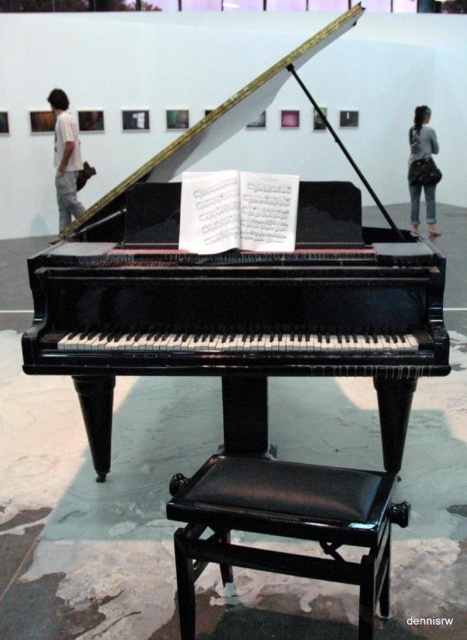
Does glossy black piano at center appear on the right side of white cotton pants at left?

Correct, you'll find glossy black piano at center to the right of white cotton pants at left.

What are the coordinates of `glossy black piano at center` in the screenshot? It's located at pos(236,292).

Does glossy black piano at center have a larger size compared to black leather stool at center?

Yes, glossy black piano at center is bigger than black leather stool at center.

Does glossy black piano at center have a smaller size compared to black leather stool at center?

No.

Where is `glossy black piano at center`? Image resolution: width=467 pixels, height=640 pixels. glossy black piano at center is located at coordinates (236, 292).

I want to click on glossy black piano at center, so click(236, 292).

Identify the location of glossy black piano at center. (236, 292).

Can you confirm if glossy black piano at center is positioned above gray fabric bag at upper right?

No.

Does point (394, 250) lie in front of point (417, 120)?

Yes, it is.

I want to click on glossy black piano at center, so click(x=236, y=292).